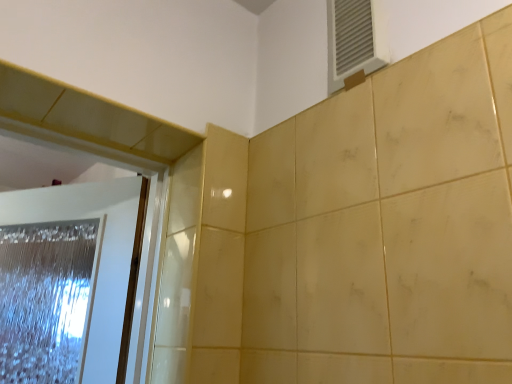
Measure the distance between white textured vent at upper right and camera.

The distance of white textured vent at upper right from camera is 31.32 inches.

What do you see at coordinates (354, 39) in the screenshot? The height and width of the screenshot is (384, 512). I see `white textured vent at upper right` at bounding box center [354, 39].

Find the location of `white textured vent at upper right`. white textured vent at upper right is located at coordinates (354, 39).

The image size is (512, 384). In order to click on white textured vent at upper right in this screenshot , I will do `click(354, 39)`.